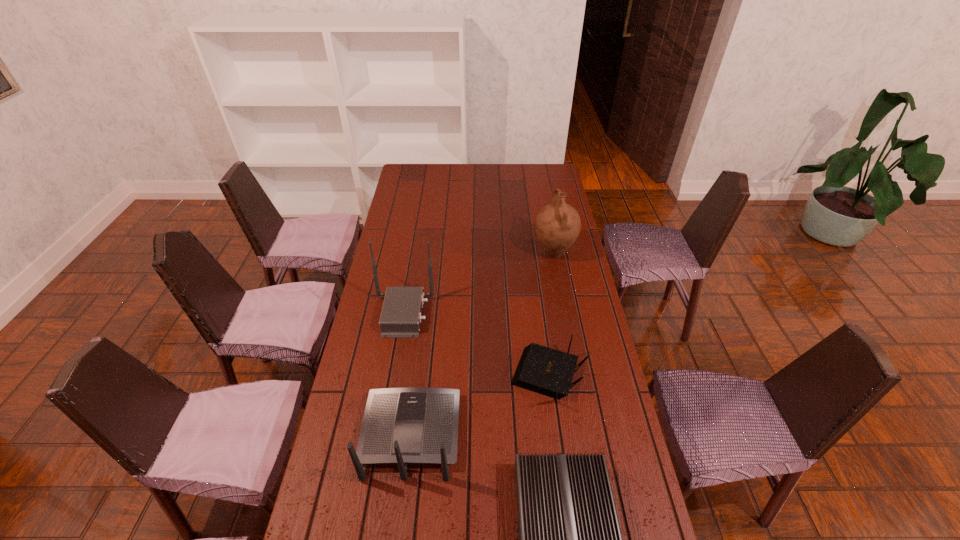
At what (x,y) coordinates should I click in order to perform the action: click on router that is the third nearest to the farthest router. Please return your answer as a coordinate pair (x, y). This screenshot has width=960, height=540. Looking at the image, I should click on (569, 539).

Locate which router is the second closest to the tallest router. Please provide its 2D coordinates. Your answer should be formatted as a tuple, i.e. [(x, y)], where the tuple contains the x and y coordinates of a point satisfying the conditions above.

[(547, 371)]

This screenshot has height=540, width=960. In order to click on free space in the image that satisfies the following two spatial constraints: 1. on the front-facing side of the second tallest router; 2. on the left side of the pitcher in this screenshot , I will do `click(433, 253)`.

You are a GUI agent. You are given a task and a screenshot of the screen. Output one action in this format:
    pyautogui.click(x=<x>, y=<y>)
    Task: Click on the blank area in the image that satisfies the following two spatial constraints: 1. on the front-facing side of the third shortest object; 2. on the back of the tallest router to connect cables
    
    Given the screenshot: What is the action you would take?
    pyautogui.click(x=425, y=314)

The image size is (960, 540). I want to click on free spot that satisfies the following two spatial constraints: 1. on the back of the fourth nearest object to connect cables; 2. on the front-facing side of the third shortest object, so click(383, 435).